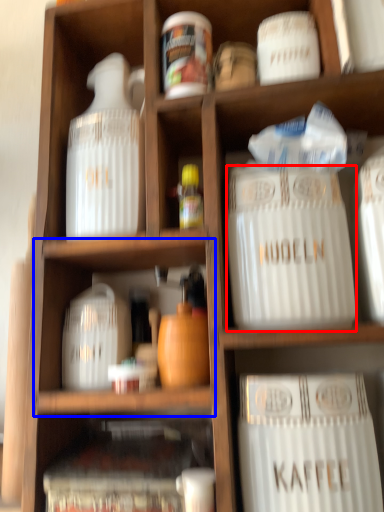
Question: Which point is closer to the camera, type (highlighted by a red box) or cabinet (highlighted by a blue box)?

Choices:
 (A) type
 (B) cabinet

Answer: (A)